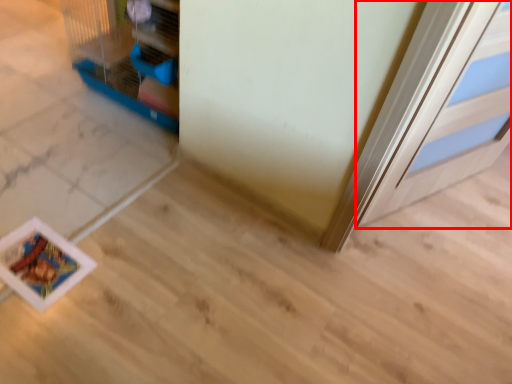
Question: From the image, what is the correct spatial relationship of door (annotated by the red box) in relation to bird cage?

Choices:
 (A) left
 (B) right

Answer: (B)